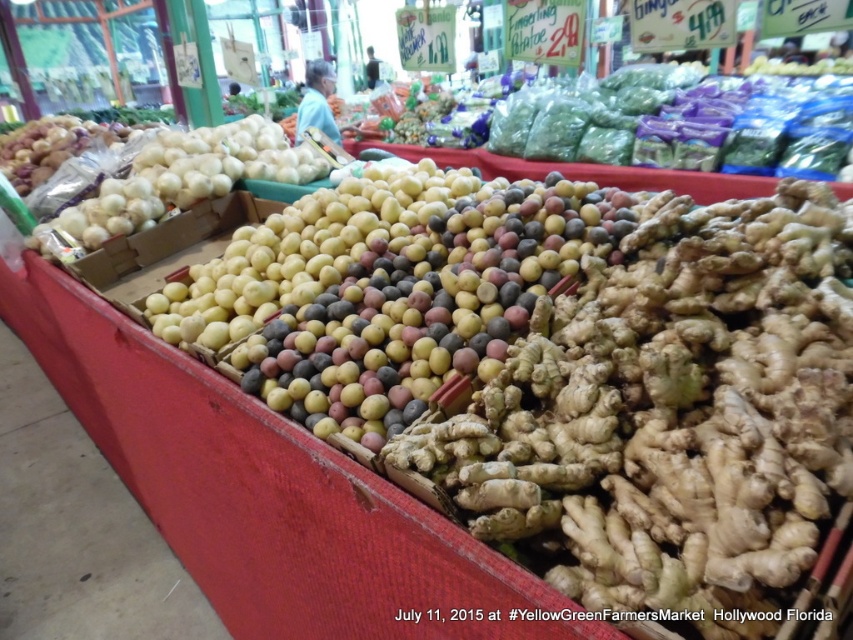
You are standing at the entrance of the YellowGreenFarmersMarket and notice two points marked in the scene. Which point, point (340, 268) or point (180, 189), is closer to you?

Point (340, 268) is closer to the viewer than point (180, 189).

You are a customer at the YellowGreenFarmersMarket and want to know which item is shorter between the multicolored matte potatoes at center and the white matte onions at left. Could you tell me?

The multicolored matte potatoes at center has a lesser height compared to white matte onions at left, so the multicolored matte potatoes at center is shorter.

You are a customer at the YellowGreenFarmersMarket and want to buy both the yellow matte potatoes at center and the white matte onions at left. If you start from the entrance, which item should you reach first?

The white matte onions at left should be reached first because the yellow matte potatoes at center is positioned on the right side of white matte onions at left, meaning the onions are closer to the entrance.